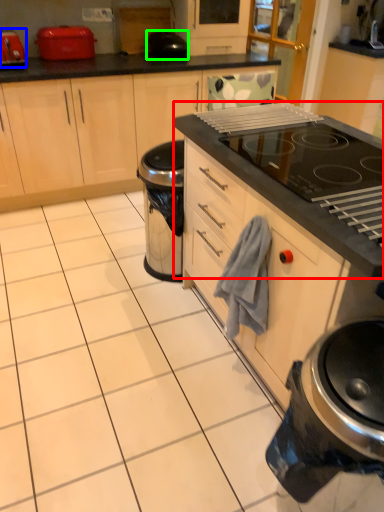
Question: Estimate the real-world distances between objects in this image. Which object is farther from oven (highlighted by a red box), kitchen appliance (highlighted by a blue box) or appliance (highlighted by a green box)?

Choices:
 (A) kitchen appliance
 (B) appliance

Answer: (A)